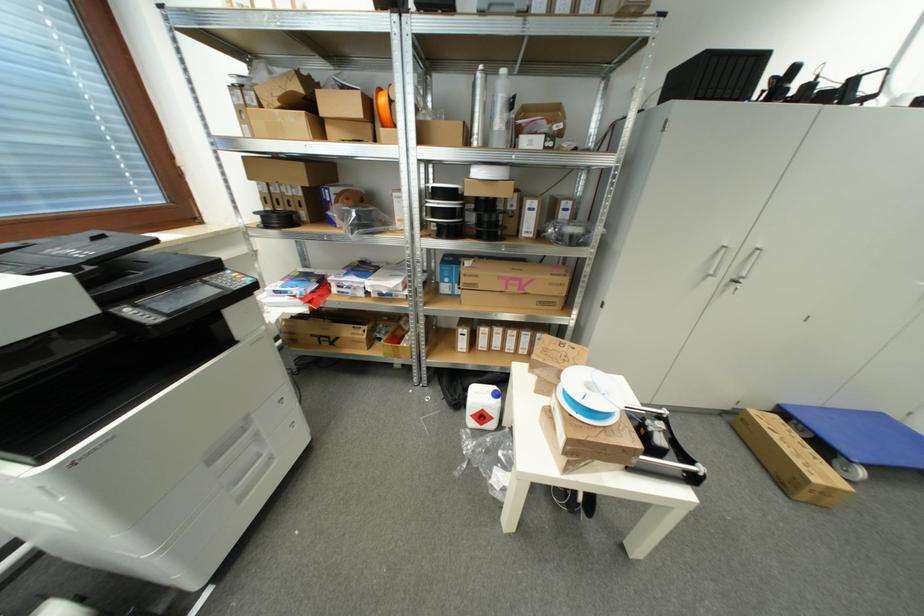
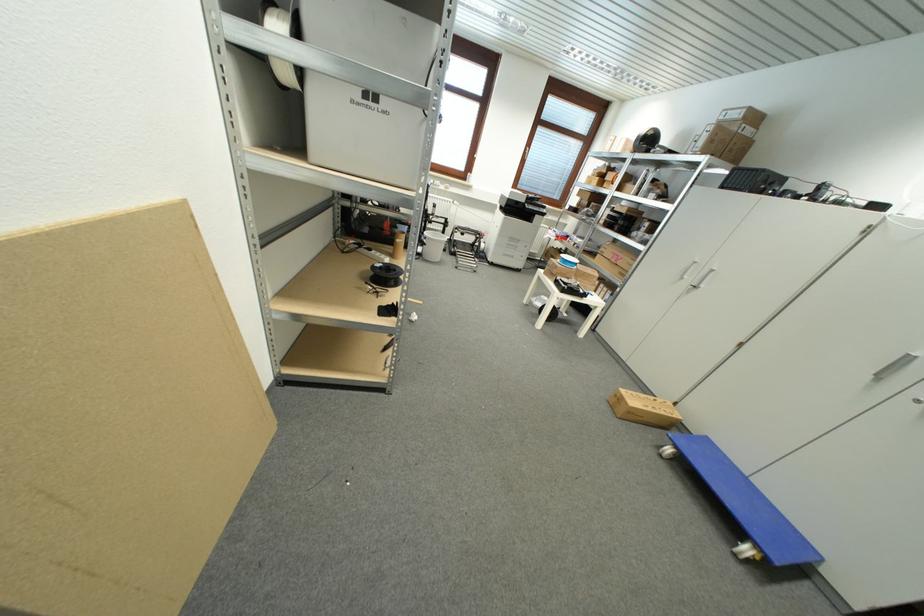
The point at (783, 408) is marked in the first image. Where is the corresponding point in the second image?

(711, 440)